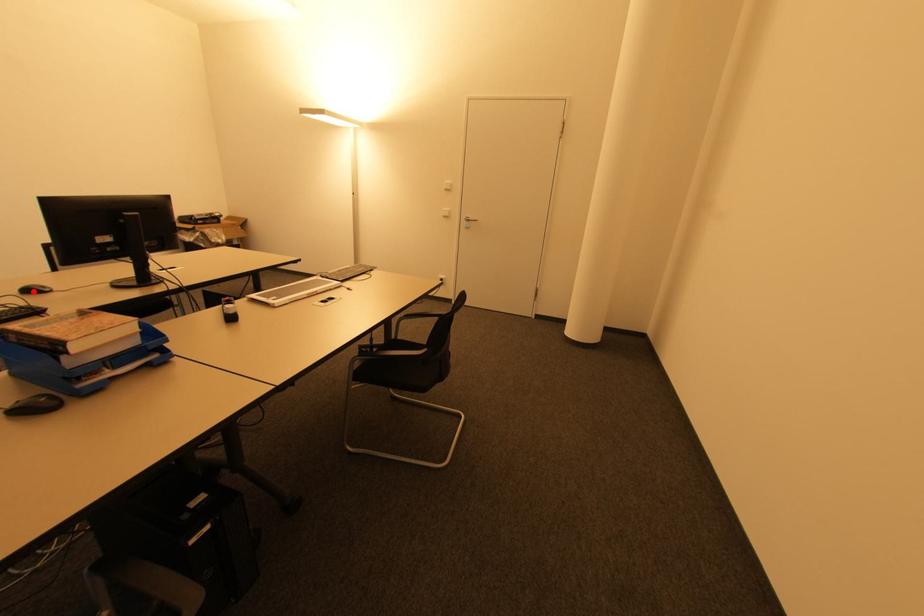
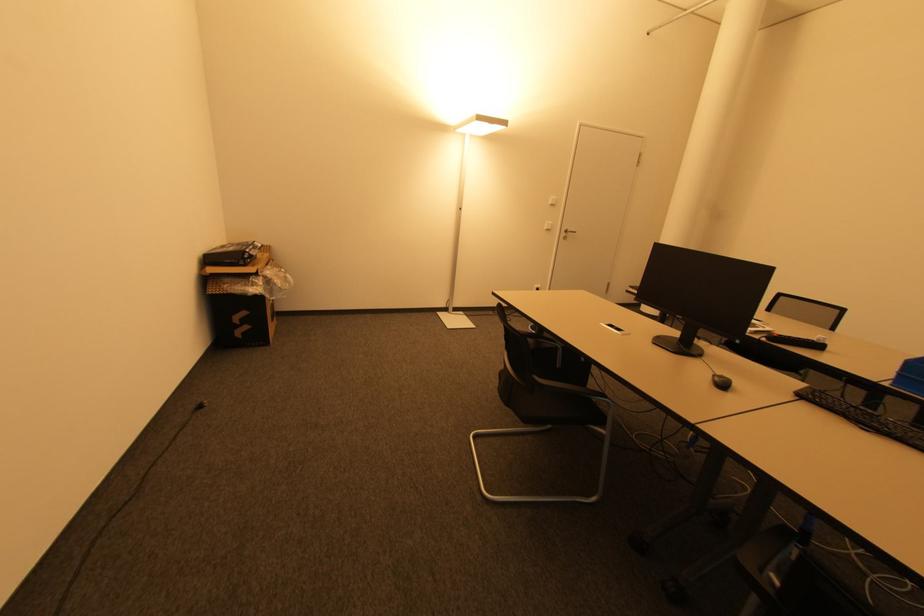
Where in the second image is the point corresponding to the highlighted location from the first image?

(725, 386)